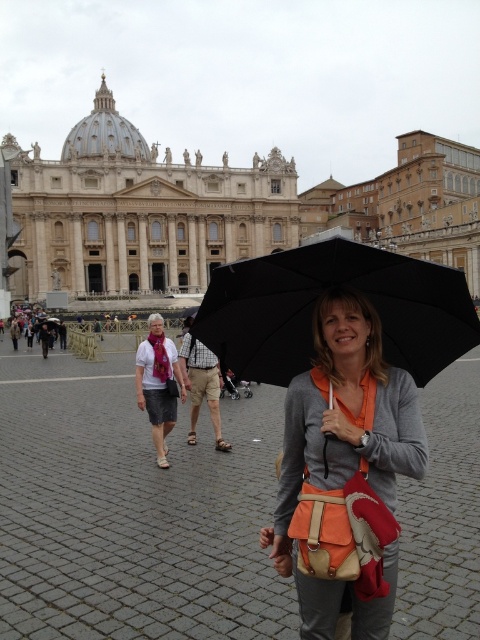
You are standing at the base of St. Peter Basilica in St. Peter Square and want to take a photo of the woman holding the black umbrella. You notice two points marked in the scene. The first point is at coordinate point (478, 404) and the second is at point (106, 198). Which point should you aim your camera at to capture the woman holding the black umbrella in the foreground?

You should aim your camera at point (478, 404) because it is in front of point (106, 198), meaning the woman holding the black umbrella is closer to the viewer at that location.

You are a tourist visiting St. Peter Square and you see a woman holding a black matte umbrella at center and wearing a matte white shirt at center. Which object is covering the other?

The black matte umbrella at center is positioned over matte white shirt at center, so the umbrella is covering the shirt.

In the scene shown: You are standing in St. Peter Square and want to take a photo of the white marble palace at upper center without the orange fabric umbrella at center blocking the view. Is it possible to do so by moving forward?

The orange fabric umbrella at center is closer to the viewer than the white marble palace at upper center. Moving forward would bring the umbrella even closer, making it more likely to block the view. Therefore, it is not possible to take a photo without the umbrella blocking the palace by moving forward. Instead, you should move sideways or backward to position yourself where the umbrella is no longer in front of the palace.